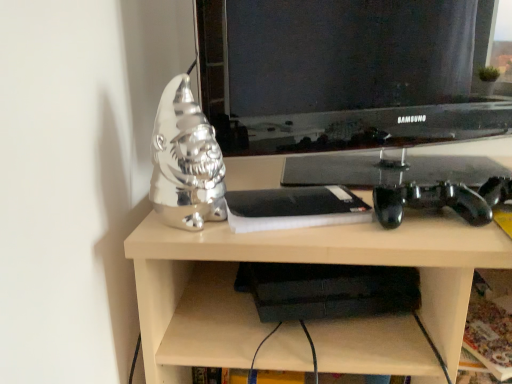
In the scene shown: Measure the distance between shiny silver gnome at left and camera.

They are 21.89 inches apart.

This screenshot has height=384, width=512. Identify the location of matte black television at center. (343, 73).

From the image's perspective, between matte black television at center and shiny silver gnome at left, who is located below?

shiny silver gnome at left, from the image's perspective.

Where is `figurine below the matte black television at center (from a real-world perspective)`? figurine below the matte black television at center (from a real-world perspective) is located at coordinates click(x=186, y=161).

Could you tell me if matte black television at center is facing shiny silver gnome at left?

Yes, matte black television at center faces towards shiny silver gnome at left.

Does matte black television at center have a smaller size compared to shiny silver gnome at left?

Incorrect, matte black television at center is not smaller in size than shiny silver gnome at left.

I want to click on figurine above the metallic silver gnome at left (from a real-world perspective), so click(x=186, y=161).

Do you think shiny silver gnome at left is within metallic silver gnome at left, or outside of it?

shiny silver gnome at left is outside metallic silver gnome at left.

Consider the image. Is shiny silver gnome at left to the left or to the right of metallic silver gnome at left in the image?

shiny silver gnome at left is positioned on metallic silver gnome at left's left side.

Is point (206, 149) closer or farther from the camera than point (252, 174)?

Point (206, 149) is closer to the camera than point (252, 174).

Is metallic silver gnome at left with shiny silver gnome at left?

No, metallic silver gnome at left is not beside shiny silver gnome at left.

Is metallic silver gnome at left at the right side of shiny silver gnome at left?

Yes.

Between point (224, 348) and point (156, 151), which one is positioned in front?

The point (156, 151) is closer.

Does metallic silver gnome at left contain matte black television at center?

No, matte black television at center is located outside of metallic silver gnome at left.

From the image's perspective, is metallic silver gnome at left beneath matte black television at center?

Yes, from the image's perspective, metallic silver gnome at left is beneath matte black television at center.

Find the location of `television above the metallic silver gnome at left (from a real-world perspective)`. television above the metallic silver gnome at left (from a real-world perspective) is located at coordinates (343, 73).

What's the angular difference between metallic silver gnome at left and matte black television at center's facing directions?

They differ by 21.7 degrees in their facing directions.

Is matte black television at center turned away from metallic silver gnome at left?

matte black television at center is not turned away from metallic silver gnome at left.

Choose the correct answer: Is matte black television at center inside metallic silver gnome at left or outside it?

matte black television at center is not inside metallic silver gnome at left, it's outside.

Is matte black television at center positioned before metallic silver gnome at left?

That is False.

Is shiny silver gnome at left turned away from matte black television at center?

Yes, shiny silver gnome at left is facing away from matte black television at center.

Does shiny silver gnome at left have a greater height compared to matte black television at center?

No.

From the image's perspective, does shiny silver gnome at left appear lower than matte black television at center?

Yes.

Find the location of a particular element. The height and width of the screenshot is (384, 512). figurine in front of the matte black television at center is located at coordinates (186, 161).

You are a GUI agent. You are given a task and a screenshot of the screen. Output one action in this format:
    pyautogui.click(x=<x>, y=<y>)
    Task: Click on the desk below the shiny silver gnome at left (from the image's perspective)
    
    Given the screenshot: What is the action you would take?
    pyautogui.click(x=294, y=262)

Consider the image. Based on their spatial positions, is metallic silver gnome at left or matte black television at center further from shiny silver gnome at left?

matte black television at center is further to shiny silver gnome at left.

In the scene shown: Based on their spatial positions, is matte black television at center or metallic silver gnome at left closer to shiny silver gnome at left?

metallic silver gnome at left.

Which object lies further to the anchor point matte black television at center, metallic silver gnome at left or shiny silver gnome at left?

Among the two, shiny silver gnome at left is located further to matte black television at center.

Which object lies nearer to the anchor point metallic silver gnome at left, matte black television at center or shiny silver gnome at left?

Among the two, shiny silver gnome at left is located nearer to metallic silver gnome at left.

Looking at the image, which one is located further to metallic silver gnome at left, shiny silver gnome at left or matte black television at center?

matte black television at center.

When comparing their distances from matte black television at center, does shiny silver gnome at left or metallic silver gnome at left seem closer?

Based on the image, metallic silver gnome at left appears to be nearer to matte black television at center.

At what (x,y) coordinates should I click in order to perform the action: click on figurine between matte black television at center and metallic silver gnome at left in the vertical direction. Please return your answer as a coordinate pair (x, y). Looking at the image, I should click on (186, 161).